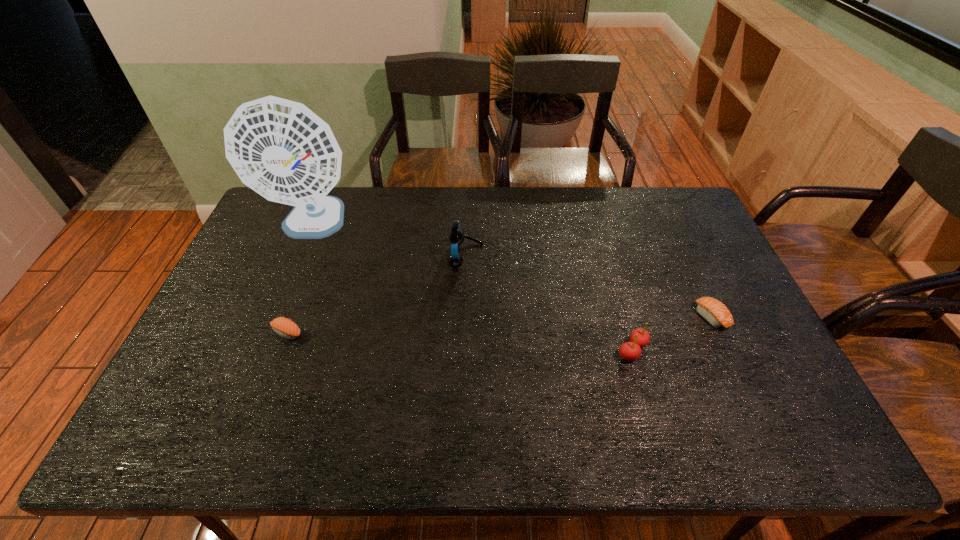
Identify the location of unoccupied position between the left sushi and the right sushi. This screenshot has height=540, width=960. (499, 325).

Point out which object is positioned as the second nearest to the headset. Please provide its 2D coordinates. Your answer should be formatted as a tuple, i.e. [(x, y)], where the tuple contains the x and y coordinates of a point satisfying the conditions above.

[(629, 351)]

Choose which object is the fourth nearest neighbor to the left sushi. Please provide its 2D coordinates. Your answer should be formatted as a tuple, i.e. [(x, y)], where the tuple contains the x and y coordinates of a point satisfying the conditions above.

[(716, 313)]

What are the coordinates of `free space in the image that satisfies the following two spatial constraints: 1. with the microphone attached to the side of the headset; 2. on the right side of the cherry` in the screenshot? It's located at (464, 350).

The image size is (960, 540). I want to click on blank area in the image that satisfies the following two spatial constraints: 1. with the microphone attached to the side of the headset; 2. on the left side of the right sushi, so click(465, 316).

This screenshot has height=540, width=960. What are the coordinates of `free space in the image that satisfies the following two spatial constraints: 1. on the grille of the rightmost object; 2. on the left side of the fan` in the screenshot? It's located at tap(276, 316).

Where is `blank space that satisfies the following two spatial constraints: 1. on the grille of the rightmost object; 2. on the right side of the fan`? blank space that satisfies the following two spatial constraints: 1. on the grille of the rightmost object; 2. on the right side of the fan is located at coordinates (276, 316).

The width and height of the screenshot is (960, 540). In order to click on vacant region that satisfies the following two spatial constraints: 1. on the grille of the tallest object; 2. on the left side of the third shortest object in this screenshot , I will do `click(261, 350)`.

At what (x,y) coordinates should I click in order to perform the action: click on vacant area in the image that satisfies the following two spatial constraints: 1. on the grille of the tallest object; 2. on the right side of the right sushi. Please return your answer as a coordinate pair (x, y). The height and width of the screenshot is (540, 960). Looking at the image, I should click on (276, 316).

This screenshot has width=960, height=540. In order to click on vacant space that satisfies the following two spatial constraints: 1. with the microphone attached to the side of the headset; 2. on the front side of the left sushi in this screenshot , I will do `click(464, 333)`.